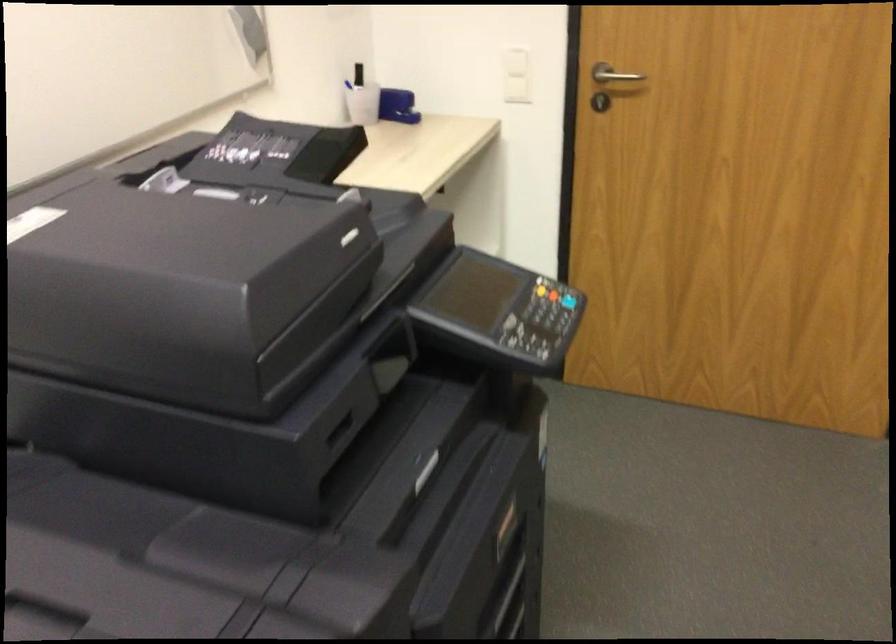
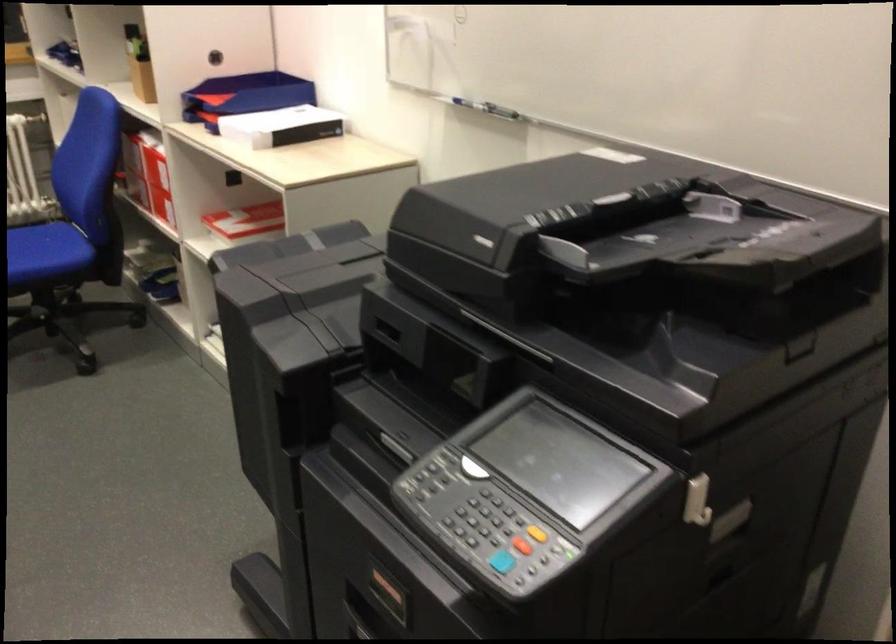
In the second image, find the point that corresponds to (442,287) in the first image.

(696, 500)